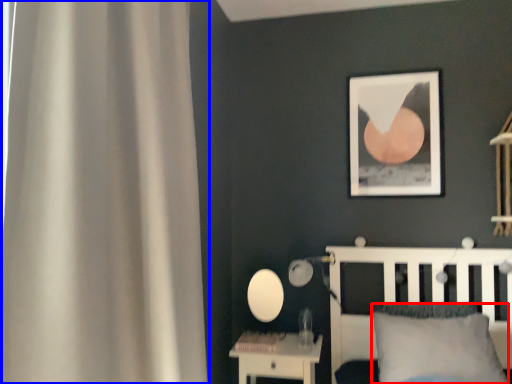
Question: Which point is further to the camera, pillow (highlighted by a red box) or curtain (highlighted by a blue box)?

Choices:
 (A) pillow
 (B) curtain

Answer: (A)